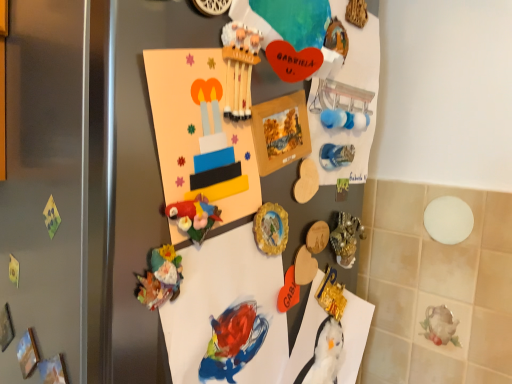
Question: Is matte orange heart at center, which is the third toy from front to back, next to blue glossy magnet at upper right, which is the 1th art in top-to-bottom order, and touching it?

Choices:
 (A) no
 (B) yes

Answer: (A)

Question: Is matte orange heart at center, the first toy when ordered from right to left, at the right side of blue glossy magnet at upper right, the second art from the bottom?

Choices:
 (A) yes
 (B) no

Answer: (B)

Question: Can you confirm if matte orange heart at center, which is the first toy in bottom-to-top order, is shorter than blue glossy magnet at upper right, which is the 1th art in top-to-bottom order?

Choices:
 (A) no
 (B) yes

Answer: (A)

Question: Is matte orange heart at center, placed as the first toy when sorted from back to front, facing towards blue glossy magnet at upper right, the second art from the bottom?

Choices:
 (A) no
 (B) yes

Answer: (A)

Question: From the image's perspective, is matte orange heart at center, placed as the first toy when sorted from back to front, under blue glossy magnet at upper right, the second art from the bottom?

Choices:
 (A) yes
 (B) no

Answer: (A)

Question: Looking at their shapes, would you say matte cardboard poster at center is wider or thinner than blue glossy magnet at upper right, the second art from the bottom?

Choices:
 (A) thin
 (B) wide

Answer: (B)

Question: From the image's perspective, is matte cardboard poster at center located above or below blue glossy magnet at upper right, which is the 1th art in top-to-bottom order?

Choices:
 (A) below
 (B) above

Answer: (A)

Question: Considering the positions of matte cardboard poster at center and blue glossy magnet at upper right, the second art from the bottom, in the image, is matte cardboard poster at center bigger or smaller than blue glossy magnet at upper right, the second art from the bottom,?

Choices:
 (A) big
 (B) small

Answer: (A)

Question: Is matte cardboard poster at center inside or outside of blue glossy magnet at upper right, which is the 1th art in top-to-bottom order?

Choices:
 (A) inside
 (B) outside

Answer: (B)

Question: Based on their sizes in the image, would you say gold metallic vase at center-right, acting as the second art starting from the top, is bigger or smaller than wooden matches at center, the 3th toy in the bottom-to-top sequence?

Choices:
 (A) big
 (B) small

Answer: (A)

Question: Relative to wooden matches at center, positioned as the second toy in back-to-front order, is gold metallic vase at center-right, acting as the second art starting from the top, in front or behind?

Choices:
 (A) behind
 (B) front

Answer: (A)

Question: Based on their positions, is gold metallic vase at center-right, acting as the second art starting from the top, located to the left or right of wooden matches at center, the 3th toy in the bottom-to-top sequence?

Choices:
 (A) left
 (B) right

Answer: (B)

Question: In terms of width, does gold metallic vase at center-right, acting as the second art starting from the top, look wider or thinner when compared to wooden matches at center, arranged as the 1th toy when viewed from the top?

Choices:
 (A) wide
 (B) thin

Answer: (B)

Question: Considering the positions of matte cardboard poster at center and matte paper postcard at center in the image, is matte cardboard poster at center bigger or smaller than matte paper postcard at center?

Choices:
 (A) big
 (B) small

Answer: (A)

Question: In terms of width, does matte cardboard poster at center look wider or thinner when compared to matte paper postcard at center?

Choices:
 (A) thin
 (B) wide

Answer: (B)